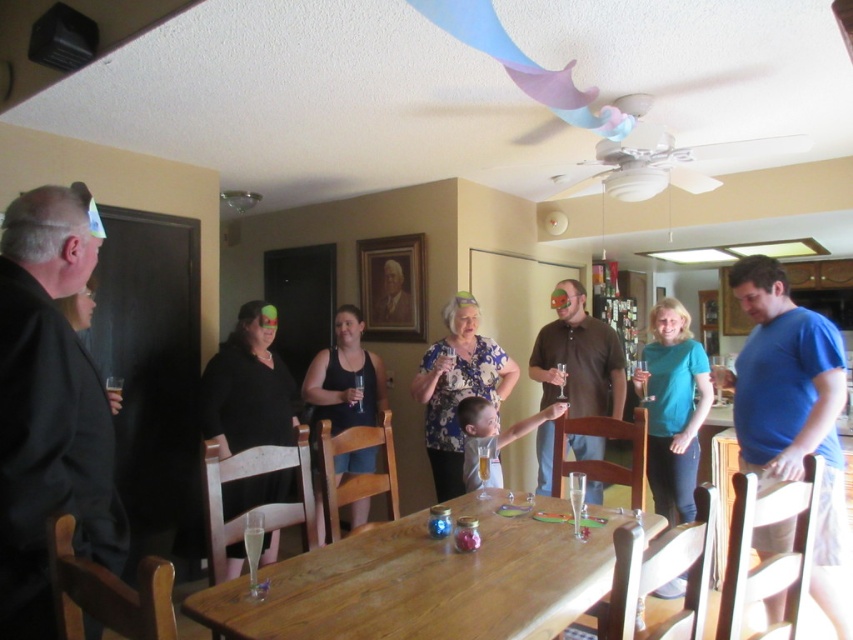
Consider the image. You are a photographer at the event and need to ensure both the floral fabric dress at center and the black tank top at center are visible in a single photo. Given their sizes, which one might require more space in the frame to capture fully?

The floral fabric dress at center has a larger width than the black tank top at center, so it would require more space in the frame to capture fully.

You are standing in the room and want to move from the black tank top at center to the wooden table at center. Which direction should you move towards?

You should move towards the left, since the wooden table at center is to the right of the black tank top at center, meaning the black tank top is to the left of the table. Therefore, moving left would take you from the tank top to the table.